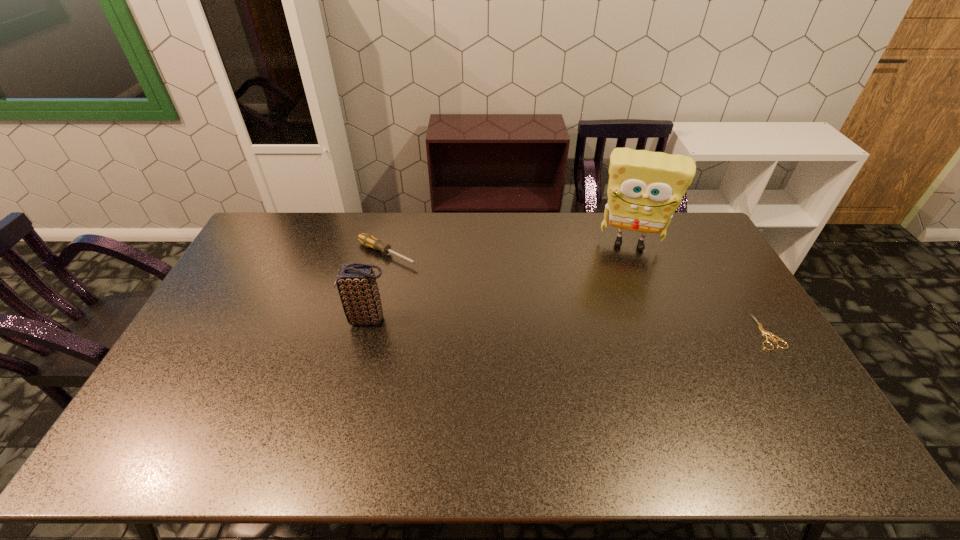
The height and width of the screenshot is (540, 960). In order to click on free spot that satisfies the following two spatial constraints: 1. on the back side of the sponge; 2. on the left side of the second shortest object in this screenshot , I will do click(391, 242).